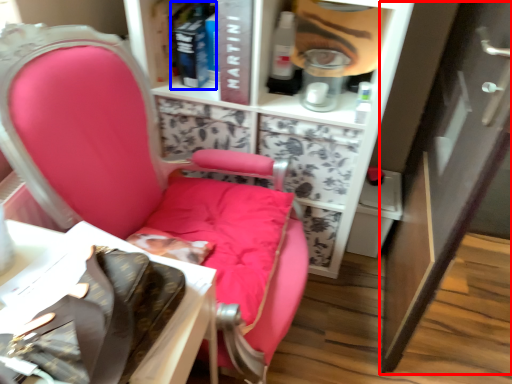
Question: Which object is further to the camera taking this photo, cabinetry (highlighted by a red box) or book (highlighted by a blue box)?

Choices:
 (A) cabinetry
 (B) book

Answer: (B)